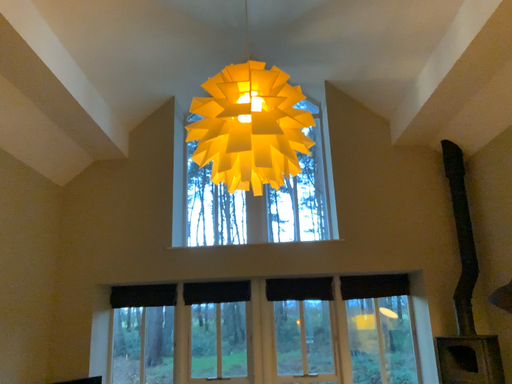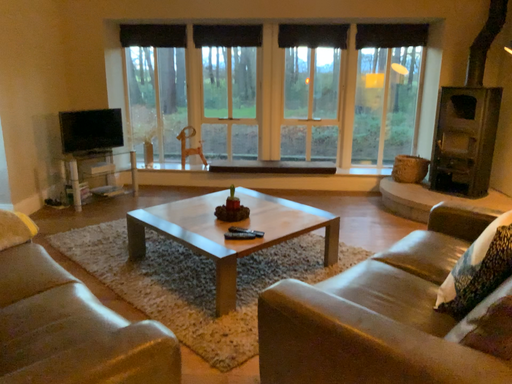
Question: Which way did the camera rotate in the video?

Choices:
 (A) rotated downward
 (B) rotated upward

Answer: (A)